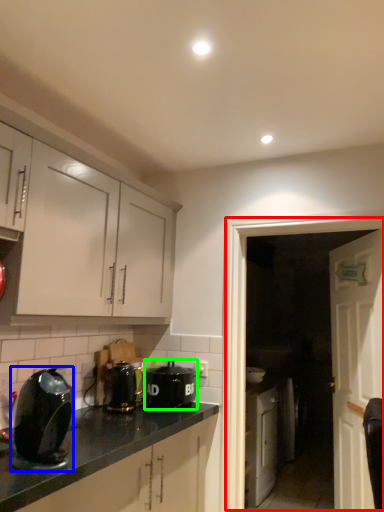
Question: Based on their relative distances, which object is nearer to glass door (highlighted by a red box)? Choose from kitchen appliance (highlighted by a blue box) and kitchen appliance (highlighted by a green box).

Choices:
 (A) kitchen appliance
 (B) kitchen appliance

Answer: (B)